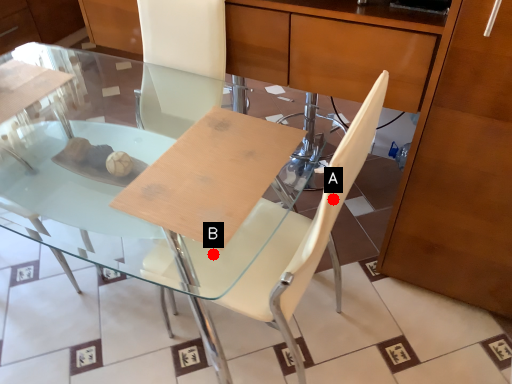
Question: Two points are circled on the image, labeled by A and B beside each circle. Which point is further to the camera?

Choices:
 (A) A is further
 (B) B is further

Answer: (B)